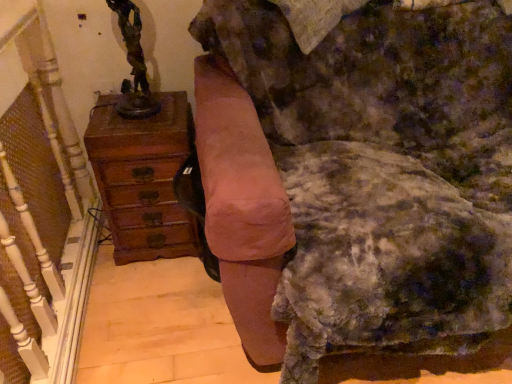
Find the location of a particular element. The image size is (512, 384). free space above wooden chest of drawers at left (from a real-world perspective) is located at coordinates (138, 105).